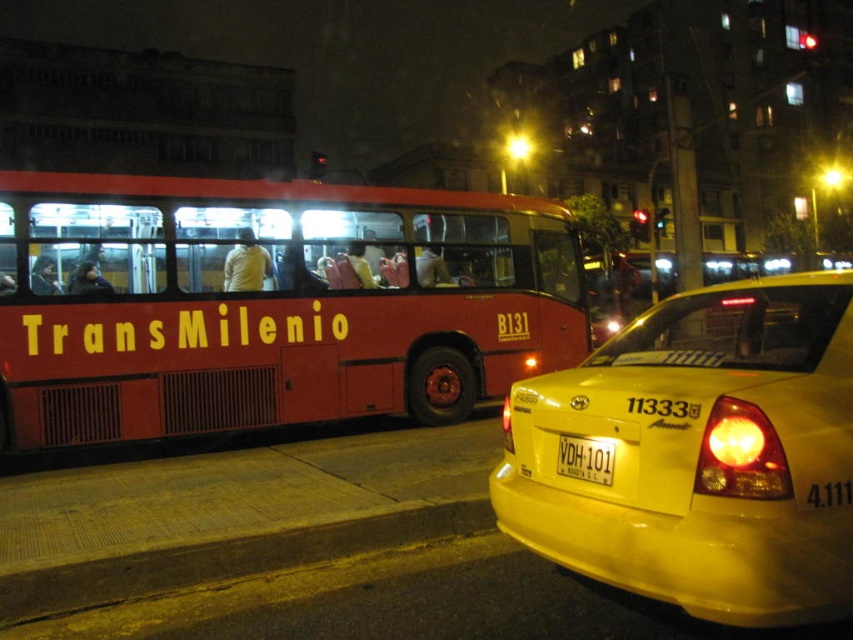
Question: Which point is farther to the camera?

Choices:
 (A) (637, 400)
 (B) (546, 253)
 (C) (422, 534)

Answer: (B)

Question: Can you confirm if yellow matte taxi at lower right is positioned to the right of yellow asphalt curb at lower left?

Choices:
 (A) yes
 (B) no

Answer: (A)

Question: Does yellow matte taxi at lower right appear under yellow asphalt curb at lower left?

Choices:
 (A) yes
 (B) no

Answer: (B)

Question: Which point is farther to the camera?

Choices:
 (A) yellow asphalt curb at lower left
 (B) red matte transmilenio bus at left

Answer: (B)

Question: Can you confirm if yellow matte taxi at lower right is bigger than yellow plastic license plate at center?

Choices:
 (A) no
 (B) yes

Answer: (B)

Question: Estimate the real-world distances between objects in this image. Which object is farther from the red matte transmilenio bus at left?

Choices:
 (A) yellow matte taxi at lower right
 (B) yellow plastic license plate at center

Answer: (B)